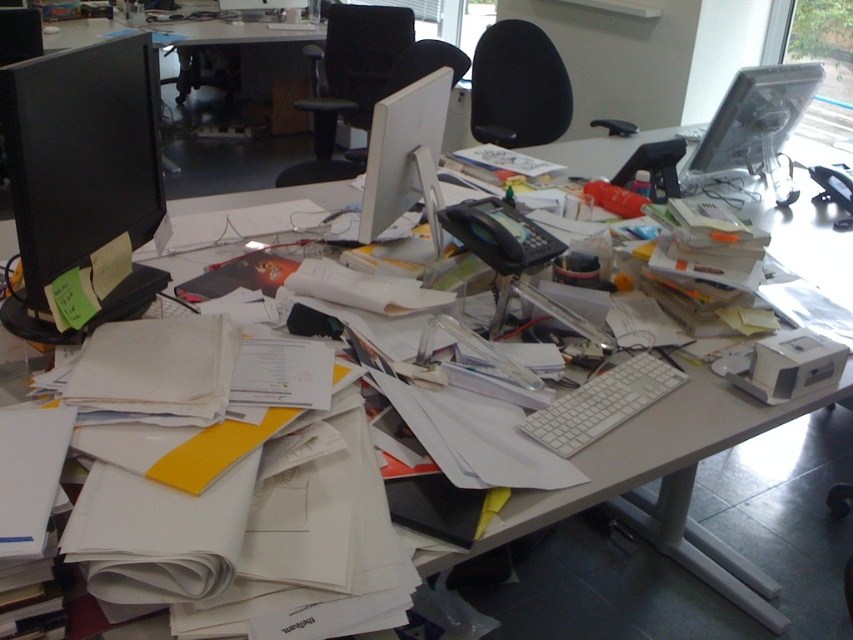
You are standing in front of the cluttered office desk and want to reach both points on the desk surface. Which point, point (434, 212) or point (579, 417), is closer to you?

Point (434, 212) is further to the camera than point (579, 417), so the point closer to you is point (579, 417).